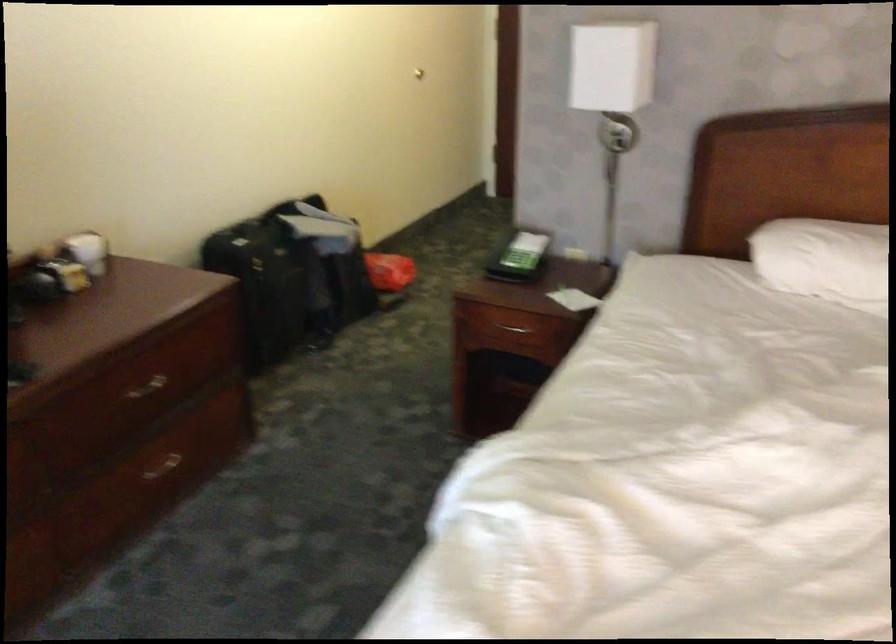
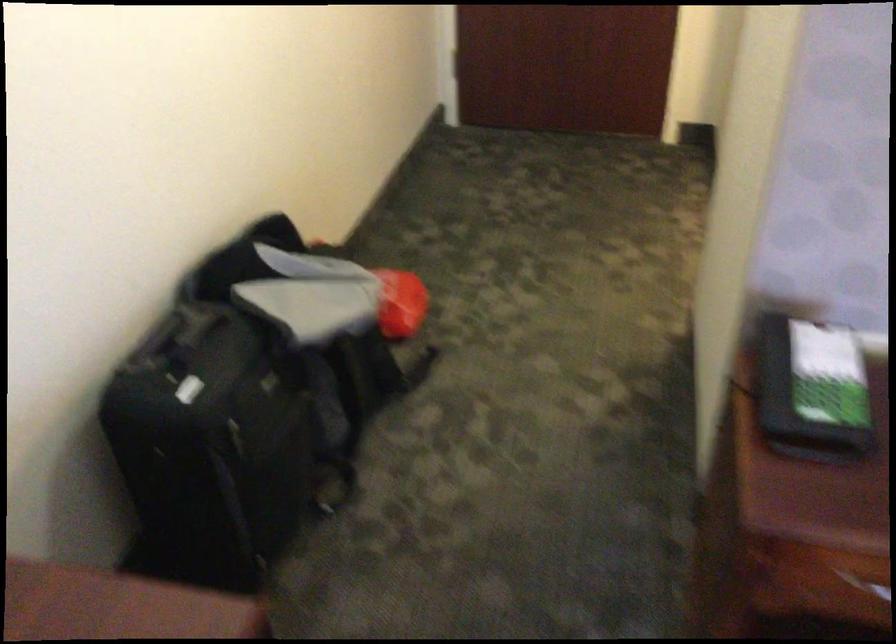
The images are taken continuously from a first-person perspective. In which direction are you moving?

The movement direction of the cameraman is left, forward.